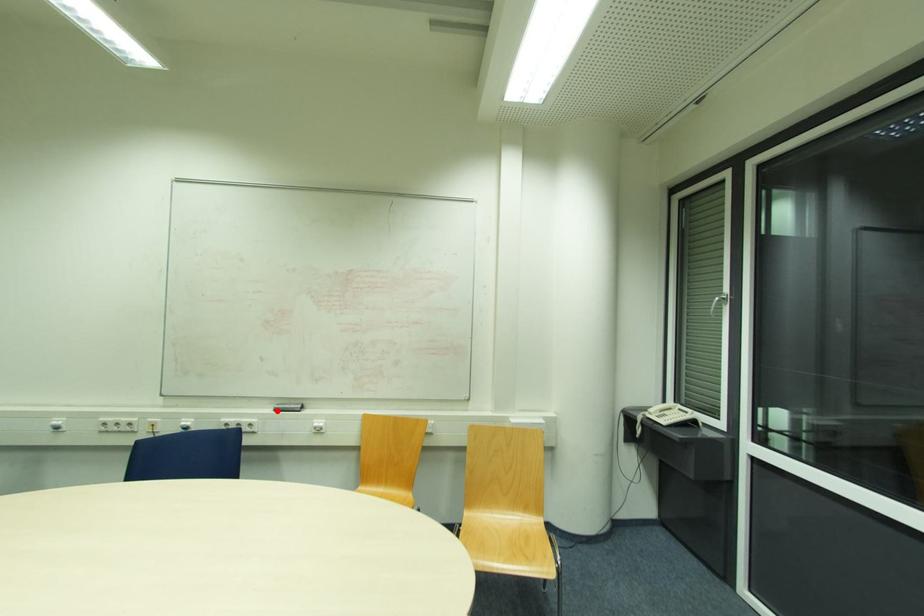
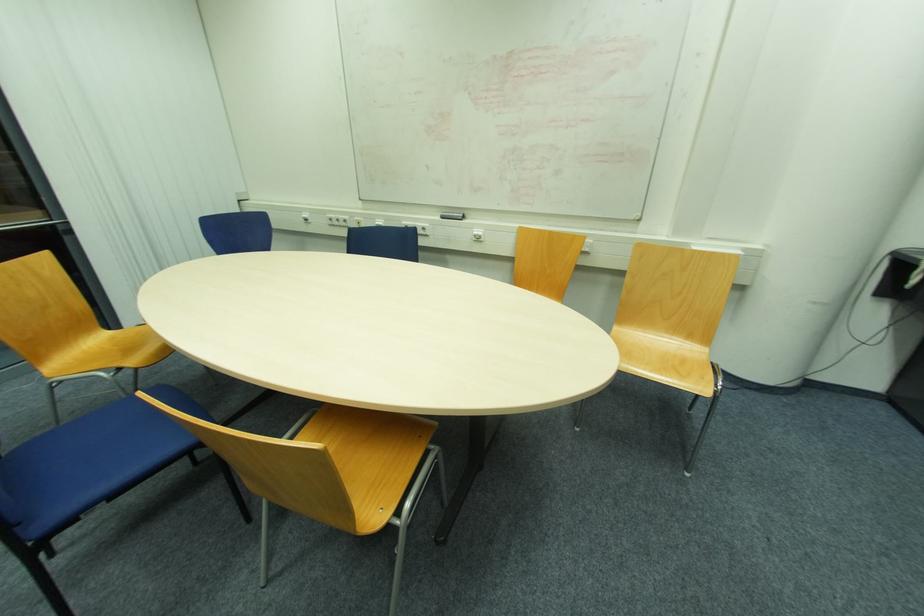
Where in the second image is the point corresponding to the highlighted location from the first image?

(444, 217)